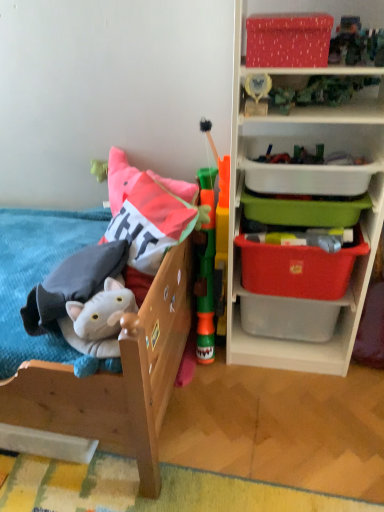
Where is `free space above red plastic storage box at right, the fourth storage box in the top-to-bottom sequence (from a real-world perspective)`? The image size is (384, 512). free space above red plastic storage box at right, the fourth storage box in the top-to-bottom sequence (from a real-world perspective) is located at coordinates (303, 238).